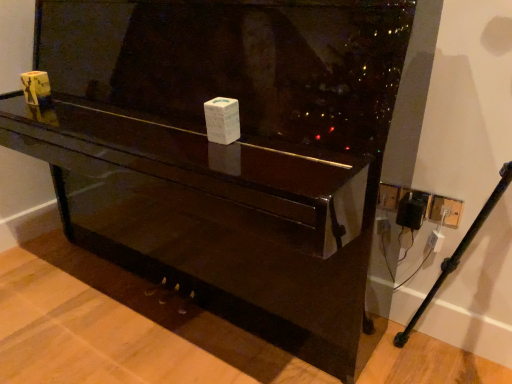
At what (x,y) coordinates should I click in order to perform the action: click on white plastic electric outlet at lower right. Please return your answer as a coordinate pair (x, y). The width and height of the screenshot is (512, 384). Looking at the image, I should click on (445, 211).

What do you see at coordinates (445, 211) in the screenshot? The height and width of the screenshot is (384, 512). I see `white plastic electric outlet at lower right` at bounding box center [445, 211].

Image resolution: width=512 pixels, height=384 pixels. What are the coordinates of `white plastic electric outlet at lower right` in the screenshot? It's located at (445, 211).